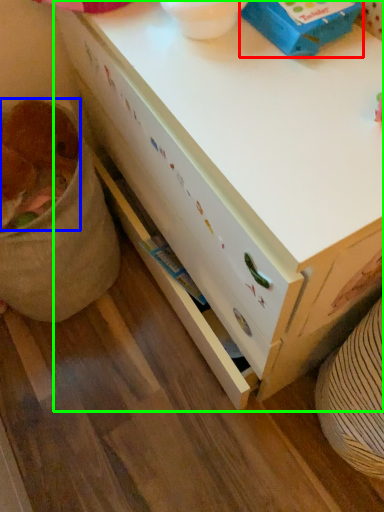
Question: Estimate the real-world distances between objects in this image. Which object is closer to box (highlighted by a red box), animal (highlighted by a blue box) or desk (highlighted by a green box)?

Choices:
 (A) animal
 (B) desk

Answer: (B)